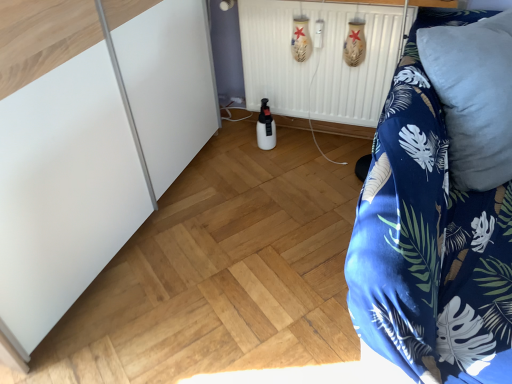
Image resolution: width=512 pixels, height=384 pixels. Find the location of `vacant space behind white matte bottle at center`. vacant space behind white matte bottle at center is located at coordinates (274, 130).